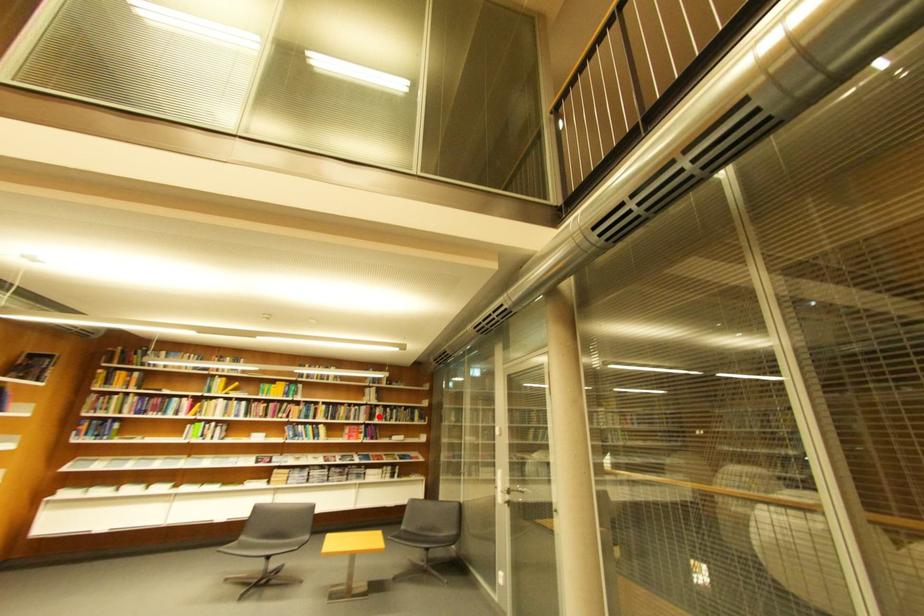
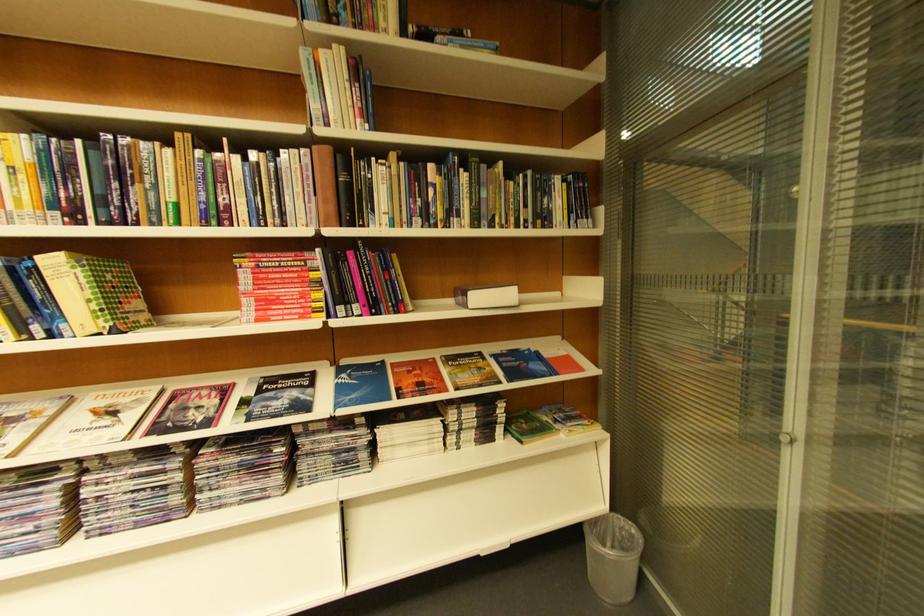
Question: A red point is marked in image1. In image2, is the corresponding 3D point closer to the camera or farther? Reply with the corresponding letter.

Choices:
 (A) The corresponding 3D point is closer.
 (B) The corresponding 3D point is farther.

Answer: (A)